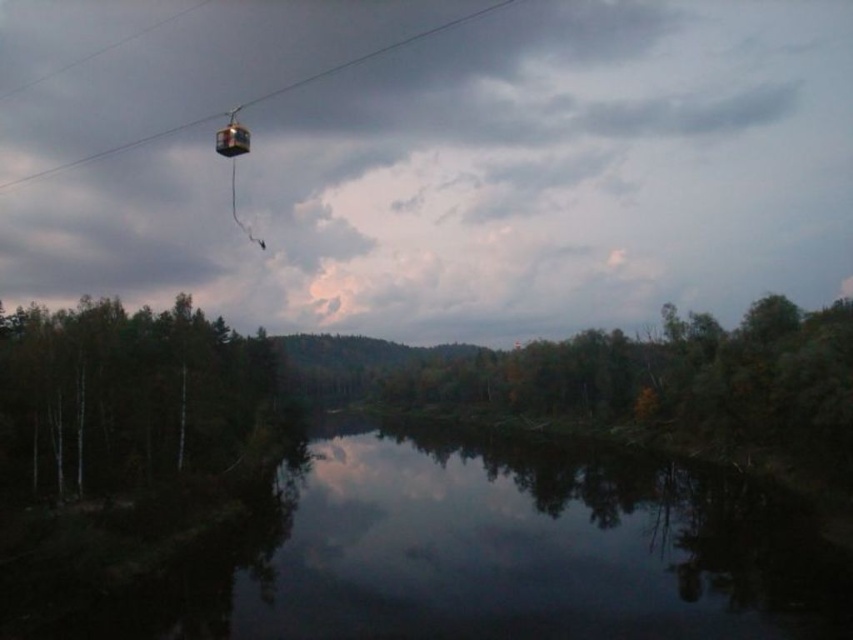
Question: Is green matte tree at left above metal cable car at upper center?

Choices:
 (A) no
 (B) yes

Answer: (A)

Question: Which point is closer to the camera?

Choices:
 (A) green matte tree at left
 (B) metal cable car at upper center

Answer: (A)

Question: Which point is closer to the camera?

Choices:
 (A) (80, 157)
 (B) (271, 403)

Answer: (B)

Question: Does green matte tree at left appear on the left side of metal cable car at upper center?

Choices:
 (A) no
 (B) yes

Answer: (A)

Question: Does green matte tree at left appear over metal cable car at upper center?

Choices:
 (A) no
 (B) yes

Answer: (A)